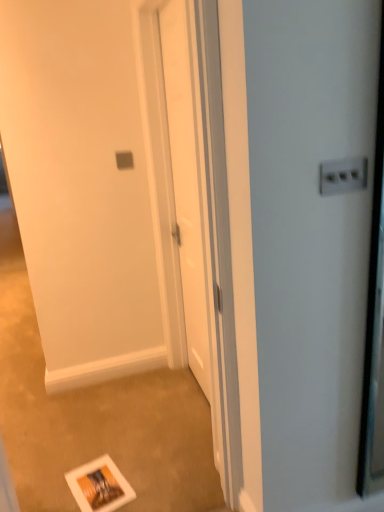
This screenshot has height=512, width=384. Identify the location of vacant area that lies to the right of white matte postcard at lower center. (148, 482).